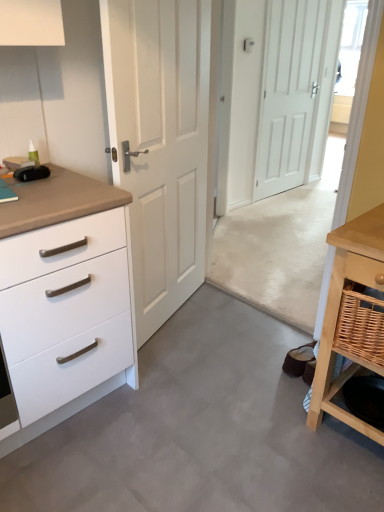
I want to click on free space that is to the left of light wood table at lower right, so click(x=272, y=422).